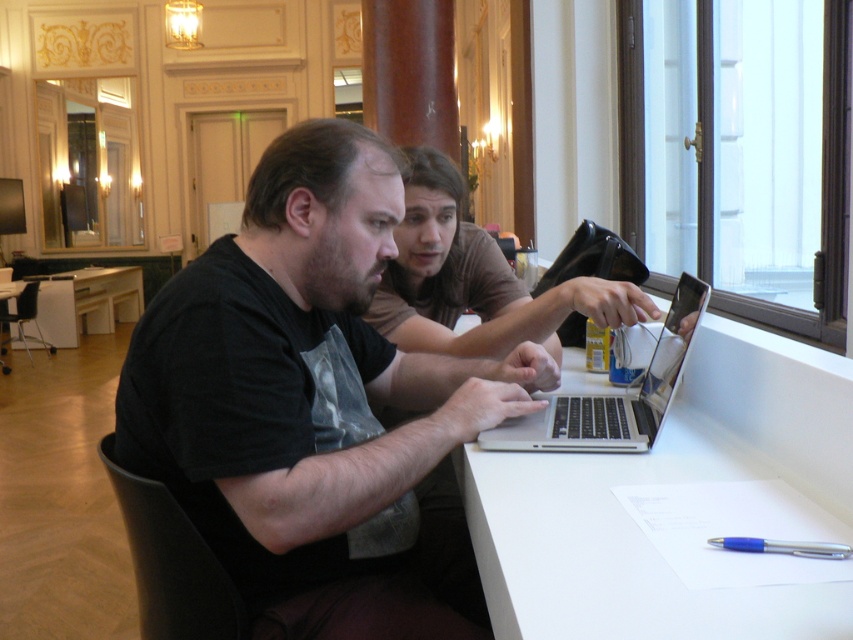
Between black matte shirt at center and silver metallic laptop at center, which one has less height?

With less height is silver metallic laptop at center.

Does black matte shirt at center come in front of silver metallic laptop at center?

Yes, black matte shirt at center is closer to the viewer.

At what (x,y) coordinates should I click in order to perform the action: click on black matte shirt at center. Please return your answer as a coordinate pair (x, y). This screenshot has width=853, height=640. Looking at the image, I should click on (314, 404).

Does brown casual shirt at center have a greater height compared to silver metallic laptop at center?

Correct, brown casual shirt at center is much taller as silver metallic laptop at center.

Describe the element at coordinates (474, 280) in the screenshot. I see `brown casual shirt at center` at that location.

Locate an element on the screen. brown casual shirt at center is located at coordinates (474, 280).

Does white matte table at center have a larger size compared to white glossy table at center?

No.

Consider the image. Is white matte table at center to the left of white glossy table at center from the viewer's perspective?

No, white matte table at center is not to the left of white glossy table at center.

Is point (817, 604) in front of point (103, 269)?

Yes, it is in front of point (103, 269).

Where is `white matte table at center`? This screenshot has height=640, width=853. white matte table at center is located at coordinates (666, 481).